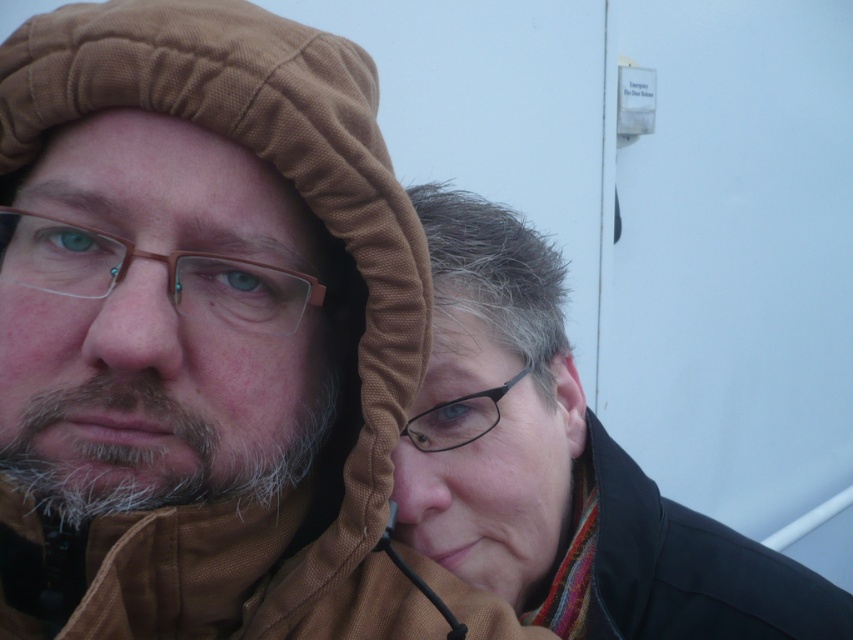
Question: Which object is farther from the camera taking this photo?

Choices:
 (A) brown quilted hood at upper left
 (B) clear plastic glasses at center
 (C) matte black jacket at center
 (D) black plastic glasses at upper center

Answer: (D)

Question: Which of these objects is positioned closest to the black plastic glasses at upper center?

Choices:
 (A) matte black jacket at center
 (B) clear plastic glasses at center
 (C) brown quilted hood at upper left

Answer: (A)

Question: Is brown quilted hood at upper left behind matte black jacket at center?

Choices:
 (A) no
 (B) yes

Answer: (A)

Question: Which object appears closest to the camera in this image?

Choices:
 (A) matte black jacket at center
 (B) black plastic glasses at upper center
 (C) brown quilted hood at upper left

Answer: (C)

Question: Is clear plastic glasses at center to the left of black plastic glasses at upper center from the viewer's perspective?

Choices:
 (A) no
 (B) yes

Answer: (B)

Question: Does matte black jacket at center come behind clear plastic glasses at center?

Choices:
 (A) no
 (B) yes

Answer: (B)